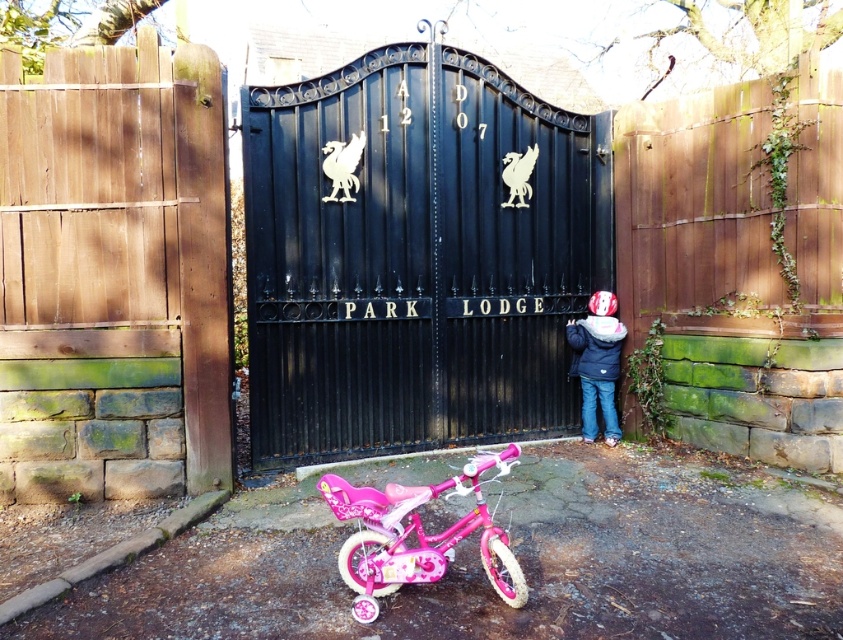
Question: Can you confirm if black metal gate at center is positioned to the right of pink glossy bicycle at lower center?

Choices:
 (A) no
 (B) yes

Answer: (B)

Question: Can you confirm if pink glossy bicycle at lower center is thinner than matte blue jacket at center?

Choices:
 (A) yes
 (B) no

Answer: (B)

Question: Which point is closer to the camera?

Choices:
 (A) (595, 346)
 (B) (511, 248)

Answer: (A)

Question: Considering the real-world distances, which object is farthest from the pink glossy bicycle at lower center?

Choices:
 (A) matte blue jacket at center
 (B) black metal gate at center

Answer: (A)

Question: Based on their relative distances, which object is farther from the matte blue jacket at center?

Choices:
 (A) pink glossy bicycle at lower center
 (B) black metal gate at center

Answer: (A)

Question: From the image, what is the correct spatial relationship of pink glossy bicycle at lower center in relation to matte blue jacket at center?

Choices:
 (A) above
 (B) below

Answer: (B)